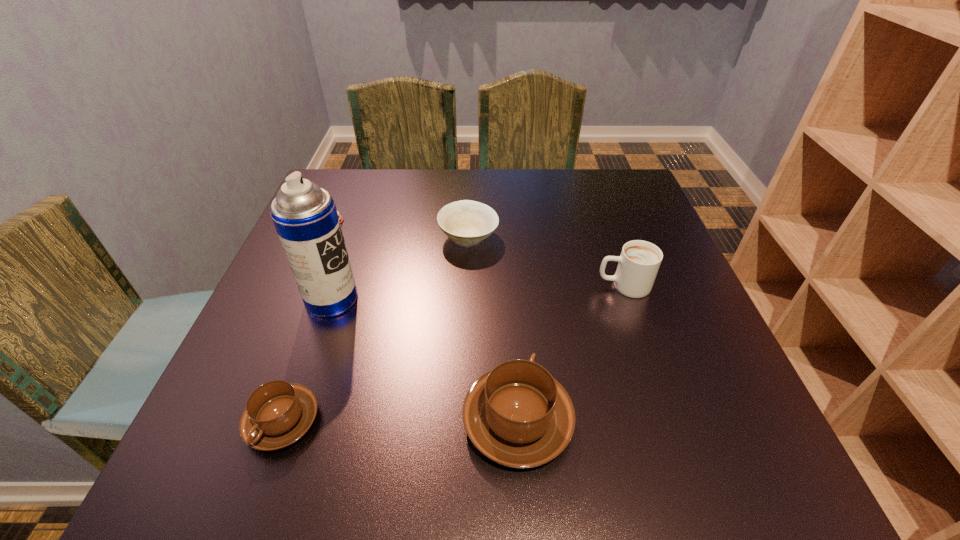
Find the location of a particular element. The height and width of the screenshot is (540, 960). object situated at the right edge is located at coordinates point(638,264).

Where is `object situated at the far left corner`? The width and height of the screenshot is (960, 540). object situated at the far left corner is located at coordinates (346, 218).

Locate an element on the screen. The height and width of the screenshot is (540, 960). object positioned at the near left corner is located at coordinates (278, 413).

At what (x,y) coordinates should I click in order to perform the action: click on vacant space at the far edge of the desktop. Please return your answer as a coordinate pair (x, y). This screenshot has width=960, height=540. Looking at the image, I should click on (435, 188).

Find the location of a particular element. vacant area at the near edge is located at coordinates (390, 424).

Image resolution: width=960 pixels, height=540 pixels. In the image, there is a desktop. Identify the location of vacant space at the left edge. (347, 229).

Identify the location of vacant space at the right edge of the desktop. The image size is (960, 540). (637, 331).

The width and height of the screenshot is (960, 540). In the image, there is a desktop. In order to click on vacant area at the far left corner in this screenshot , I will do `click(337, 200)`.

Find the location of a particular element. vacant space at the near left corner is located at coordinates (313, 382).

The width and height of the screenshot is (960, 540). I want to click on vacant space at the far right corner of the desktop, so point(596,202).